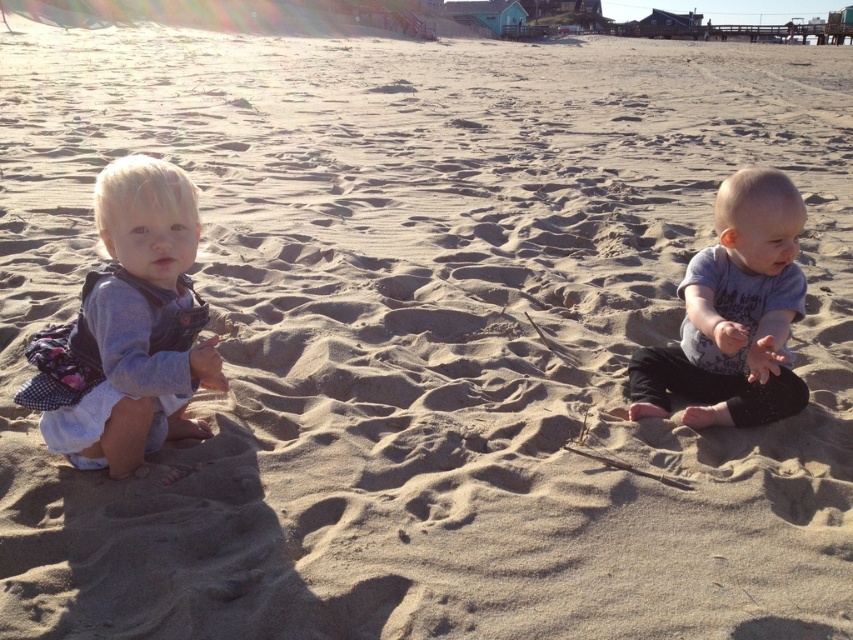
Question: Among these objects, which one is nearest to the camera?

Choices:
 (A) matte gray vest at left
 (B) light blue cotton shirt at center

Answer: (A)

Question: Among these points, which one is farthest from the camera?

Choices:
 (A) (781, 410)
 (B) (113, 416)

Answer: (A)

Question: Does matte gray vest at left have a greater width compared to light blue cotton shirt at center?

Choices:
 (A) yes
 (B) no

Answer: (A)

Question: Is matte gray vest at left wider than light blue cotton shirt at center?

Choices:
 (A) no
 (B) yes

Answer: (B)

Question: In this image, where is matte gray vest at left located relative to light blue cotton shirt at center?

Choices:
 (A) left
 (B) right

Answer: (A)

Question: Which point is farther from the camera taking this photo?

Choices:
 (A) click(752, 221)
 (B) click(140, 180)

Answer: (A)